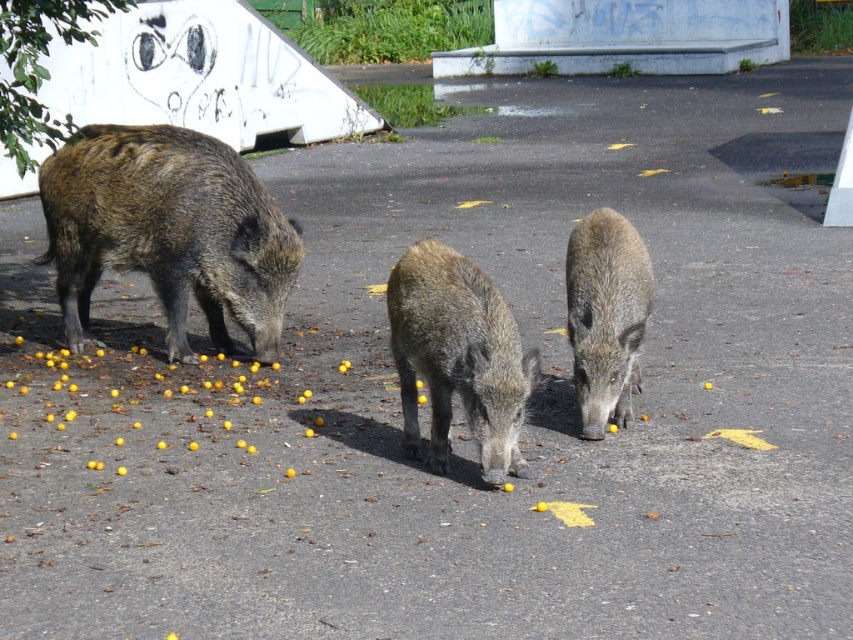
Question: Does brown textured pig at left have a greater width compared to brown rough textured pig at center?

Choices:
 (A) no
 (B) yes

Answer: (B)

Question: Does brown rough skin pig at center appear on the right side of brown rough textured pig at center?

Choices:
 (A) yes
 (B) no

Answer: (B)

Question: Which object appears farthest from the camera in this image?

Choices:
 (A) brown rough skin pig at center
 (B) brown textured pig at left
 (C) brown rough textured pig at center

Answer: (B)

Question: Does brown textured pig at left appear under brown rough skin pig at center?

Choices:
 (A) no
 (B) yes

Answer: (A)

Question: Among these objects, which one is farthest from the camera?

Choices:
 (A) brown rough skin pig at center
 (B) brown textured pig at left

Answer: (B)

Question: Which of the following is the closest to the observer?

Choices:
 (A) brown rough textured pig at center
 (B) brown rough skin pig at center

Answer: (B)